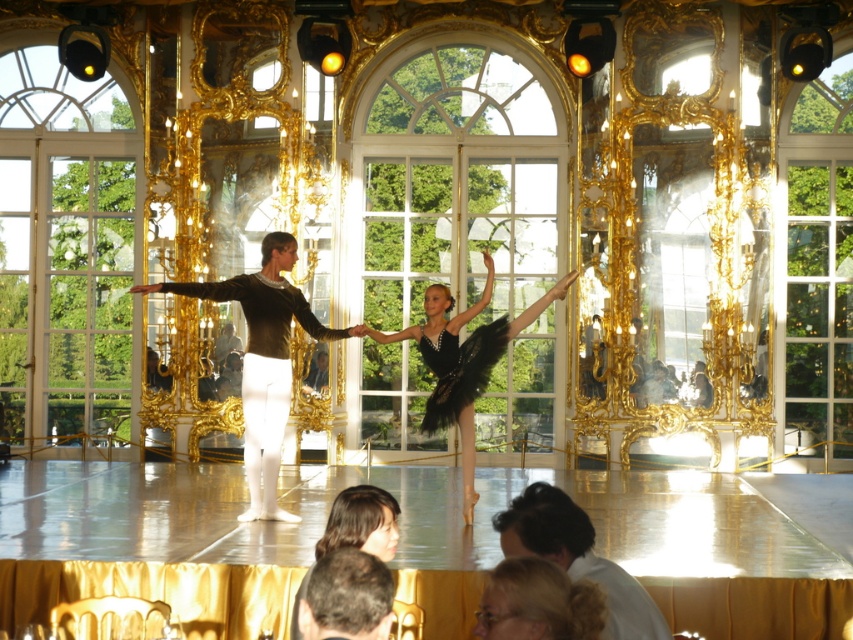
You are a photographer setting up a shoot in this ornate room. You need to position a matte black leotard at center and a black tulle skirt at center so that they don not overlap in the frame. Based on their sizes, which object should you place closer to the camera to ensure they appear distinct?

The matte black leotard at center might be wider than black tulle skirt at center, so placing the leotard closer to the camera will help it appear larger and distinct from the skirt.

You are standing in the ornately decorated room with two points marked on the floor. The first point is at coordinates point (430, 362) and the second is at point (589, 520). Which point is closer to you as you stand in the room?

Point (430, 362) is closer to you than point (589, 520) because it is further to the viewer, meaning it is physically nearer to your position in the room.

You are standing in the ornately decorated room and want to take a photo of both the point at coordinates point (218, 296) and point (463, 460). Which point should you focus on first to ensure both are in sharp focus?

You should focus on point (218, 296) first because it is closer to the camera than point (463, 460), ensuring both points are within the depth of field.